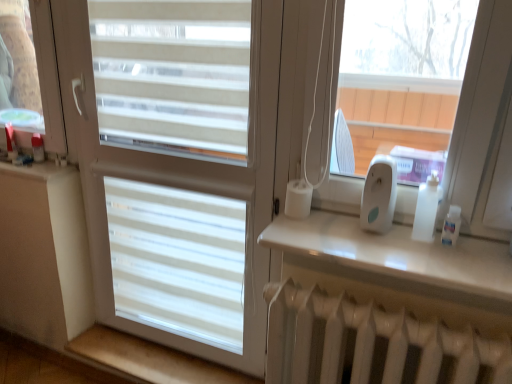
The height and width of the screenshot is (384, 512). I want to click on free spot to the left of white plastic ipod at right, so click(318, 231).